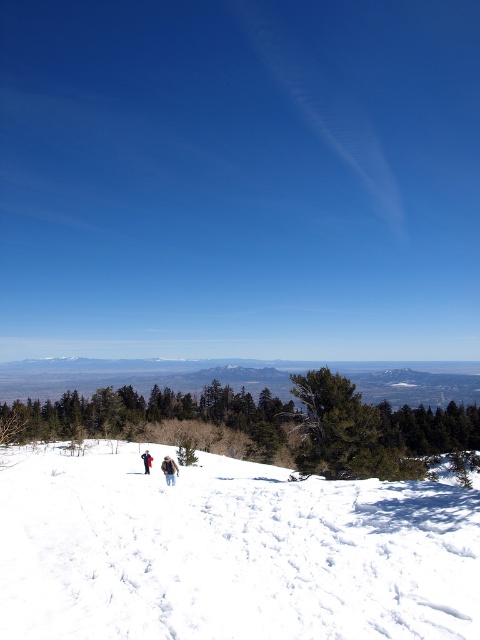
Does white powdery snow at center have a greater height compared to brown fuzzy jacket at center?

Yes, white powdery snow at center is taller than brown fuzzy jacket at center.

Consider the image. Who is shorter, white powdery snow at center or brown fuzzy jacket at center?

brown fuzzy jacket at center is shorter.

I want to click on white powdery snow at center, so click(228, 552).

Does point (173, 472) lie behind point (149, 454)?

No.

Which of these two, brown fuzzy jacket at center or brown woolen jacket at center, stands shorter?

brown fuzzy jacket at center is shorter.

Which is behind, point (166, 464) or point (148, 470)?

Positioned behind is point (148, 470).

Find the location of a particular element. brown fuzzy jacket at center is located at coordinates (169, 468).

Who is more distant from viewer, (474, 564) or (148, 472)?

Positioned behind is point (148, 472).

Does white powdery snow at center have a larger size compared to brown woolen jacket at center?

Yes.

Between point (220, 563) and point (149, 460), which one is positioned behind?

Positioned behind is point (149, 460).

Where is `white powdery snow at center`? white powdery snow at center is located at coordinates (228, 552).